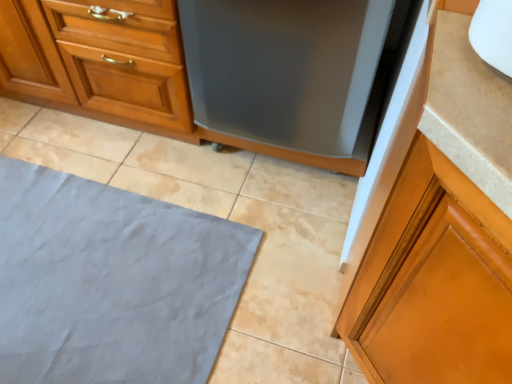
Identify the location of free space between satin black dishwasher at center and wooden cabinet at center, the 1th cabinetry viewed from the back. The width and height of the screenshot is (512, 384). (109, 141).